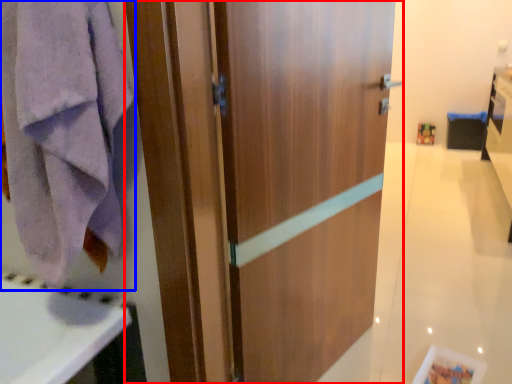
Question: Among these objects, which one is farthest to the camera, door (highlighted by a red box) or towel/napkin (highlighted by a blue box)?

Choices:
 (A) door
 (B) towel/napkin

Answer: (B)